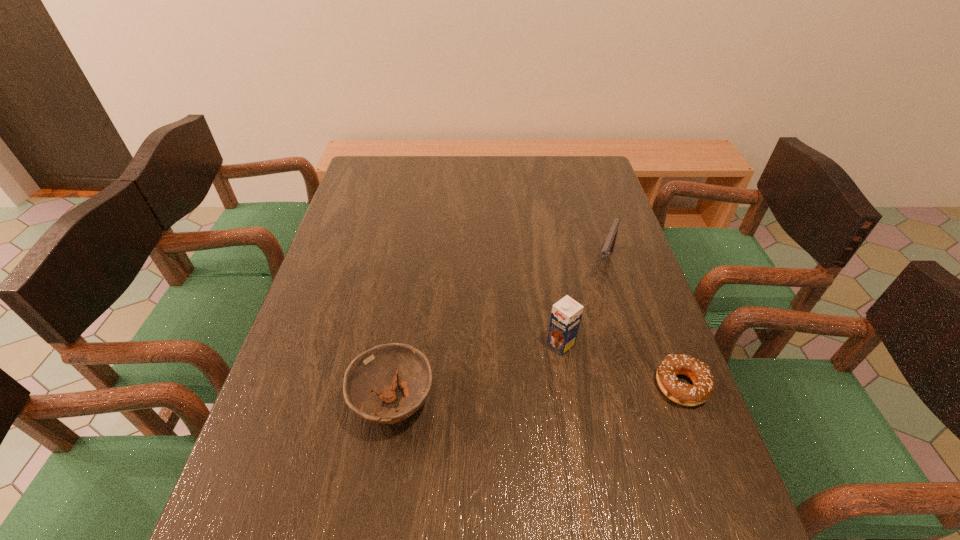
At what (x,y) coordinates should I click in order to perform the action: click on free space located 0.370m at the barrel of the pistol. Please return your answer as a coordinate pair (x, y). Looking at the image, I should click on (563, 388).

You are a GUI agent. You are given a task and a screenshot of the screen. Output one action in this format:
    pyautogui.click(x=<x>, y=<y>)
    Task: Click on the free region located 0.090m at the barrel of the pistol
    
    Given the screenshot: What is the action you would take?
    pyautogui.click(x=595, y=303)

Locate an element on the screen. Image resolution: width=960 pixels, height=540 pixels. free point located 0.330m on the front label of the chocolate milk is located at coordinates (440, 442).

Locate an element on the screen. This screenshot has width=960, height=540. free spot located on the front label of the chocolate milk is located at coordinates (470, 417).

Identify the location of vacant space located on the front label of the chocolate milk. (498, 395).

Find the location of a particular element. Image resolution: width=960 pixels, height=540 pixels. doughnut that is at the right edge is located at coordinates (685, 394).

Identify the location of pistol present at the right edge. The width and height of the screenshot is (960, 540). (608, 247).

In the image, there is a desktop. At what (x,y) coordinates should I click in order to perform the action: click on free space at the far edge. Please return your answer as a coordinate pair (x, y). The width and height of the screenshot is (960, 540). Looking at the image, I should click on (531, 159).

In the image, there is a desktop. In order to click on vacant region at the left edge in this screenshot , I will do `click(352, 197)`.

In the image, there is a desktop. Identify the location of vacant space at the right edge. (631, 384).